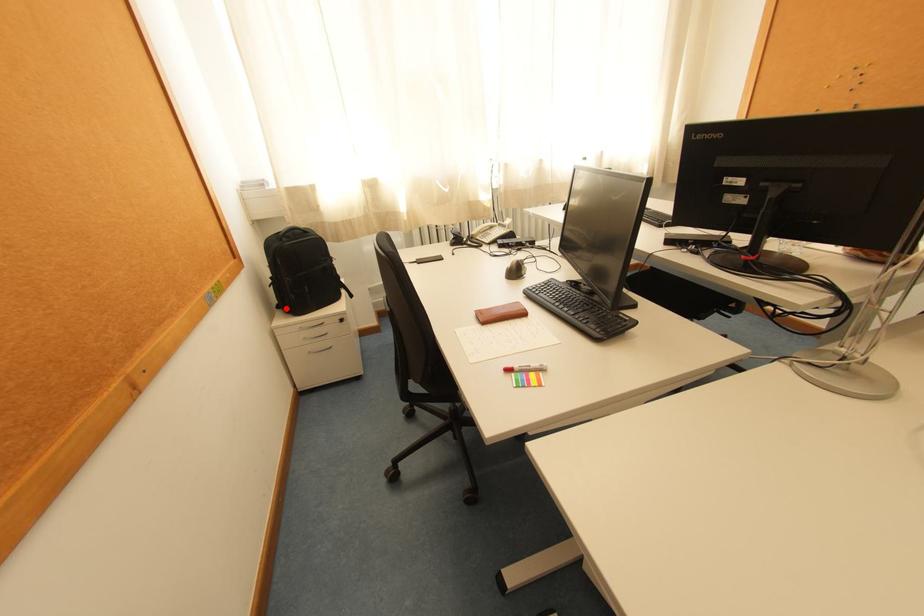
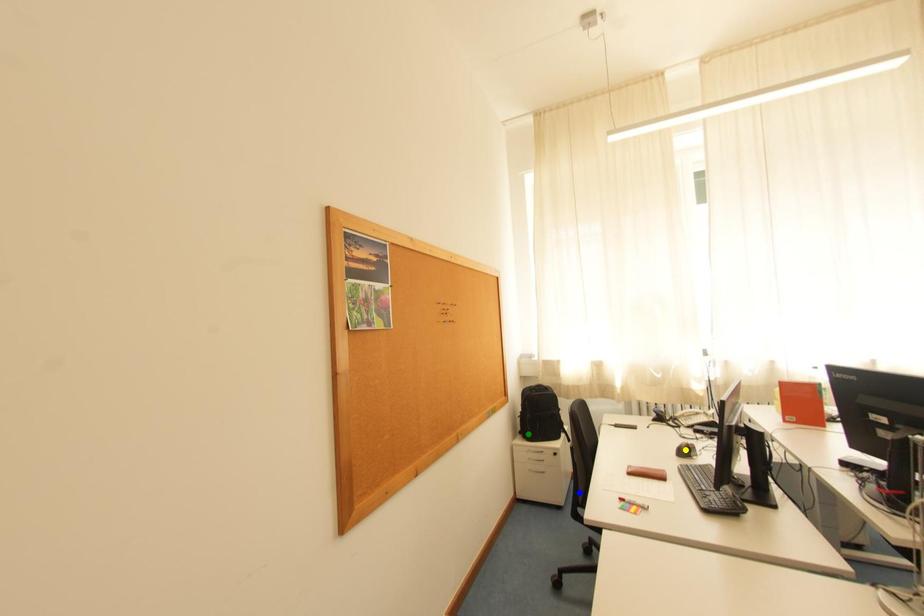
Question: I am providing you with two images of the same scene from different viewpoints. A red point is marked on the first image. You are given multiple points on the second image. Which spot in image 2 lines up with the point in image 1?

Choices:
 (A) yellow point
 (B) blue point
 (C) green point

Answer: (C)